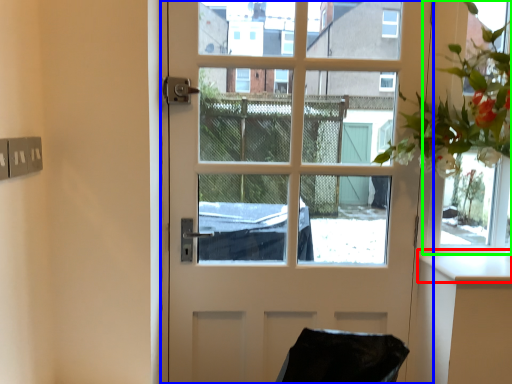
Question: Which object is the closest to the counter top (highlighted by a red box)? Choose among these: door (highlighted by a blue box) or window frame (highlighted by a green box).

Choices:
 (A) door
 (B) window frame

Answer: (B)